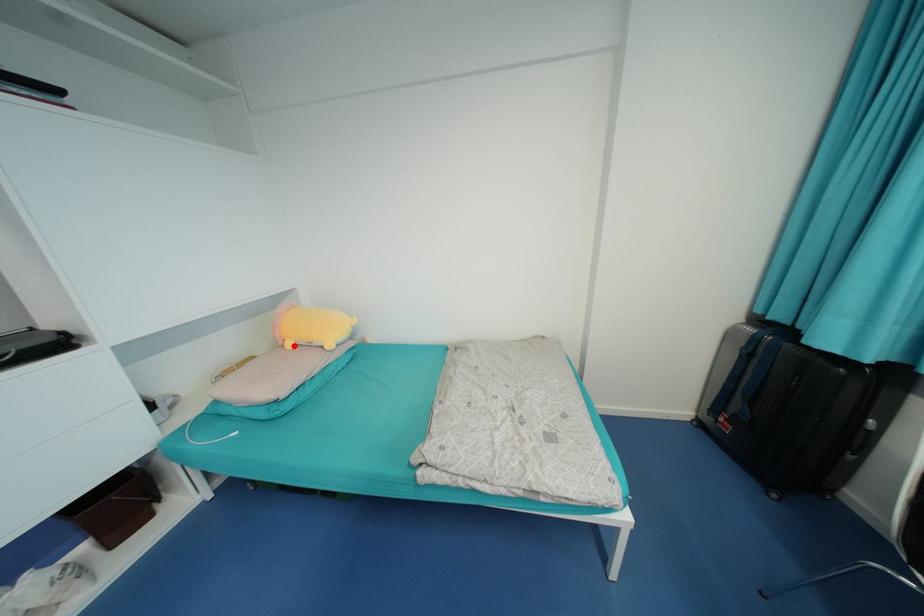
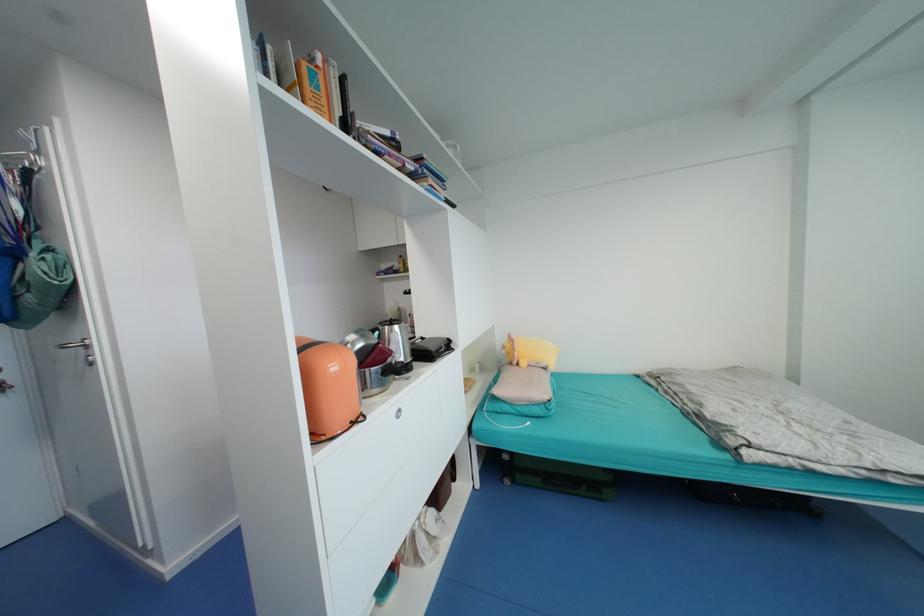
In the second image, find the point that corresponds to the highlighted location in the first image.

(529, 365)